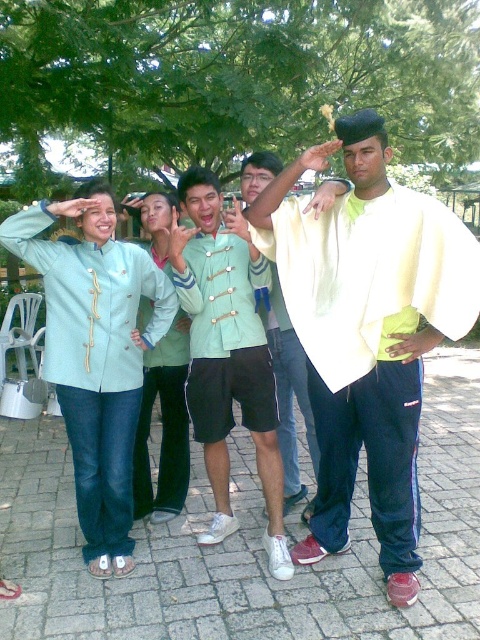
Based on the photo, you are standing in the park and see the matte green jacket at left and the light green fabric shirt at center. Which clothing item is positioned higher from the ground?

The matte green jacket at left is located above the light green fabric shirt at center, so it is positioned higher from the ground.

You are a photographer standing at the center of the scene. You want to capture a photo that includes both the matte green jacket at left and the matte green uniform at center. The camera you are using has a maximum focus range of 16 inches. Can you take the photo without moving your position?

The distance between the matte green jacket at left and the matte green uniform at center is 16.94 inches, which exceeds the camera maximum focus range of 16 inches. Therefore, you cannot take the photo without moving your position.

You are a photographer trying to capture the group photo. The camera is set at the default position. To ensure the light blue denim jacket at center is in the center of the photo, should you move the camera to the left or right?

The light blue denim jacket at center is already at point 0.667 on the x axis, which is slightly to the right of the center. To center it, you should move the camera to the left so that the jacket moves to the center of the frame.